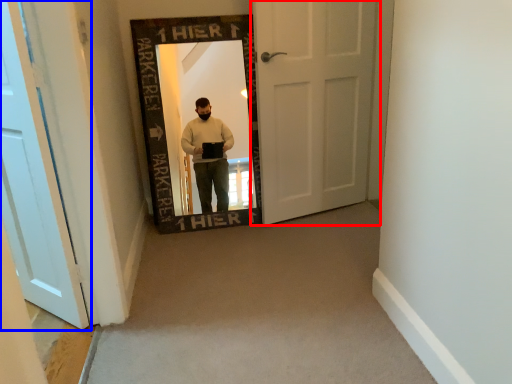
Question: Which of the following is the farthest to the observer, door (highlighted by a red box) or door (highlighted by a blue box)?

Choices:
 (A) door
 (B) door

Answer: (A)